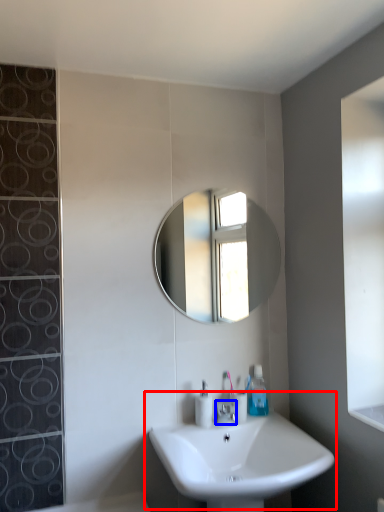
Question: Which object is closer to the camera taking this photo, sink (highlighted by a red box) or tap (highlighted by a blue box)?

Choices:
 (A) sink
 (B) tap

Answer: (A)